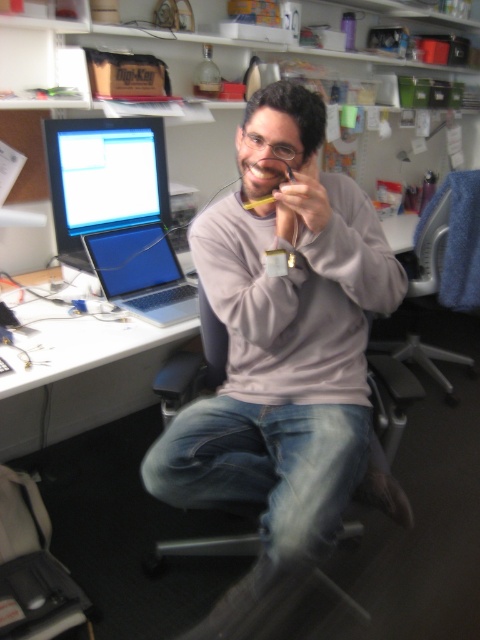
You are a delivery person who needs to place a small package on the desk. The package is too big to fit between the gray matte sweatshirt at center and the silver metallic laptop at left. Where should you place it instead?

Since the gray matte sweatshirt at center is closer to the viewer than the silver metallic laptop at left, the space between them is limited. To place the package, you should consider putting it either to the far right of the desk or behind the silver metallic laptop at left where there might be more space available.

You are a delivery robot trying to navigate to the desk. There are two points in your path. The first point is at point (179, 340) and the second point is at point (106, 129). Which point should you reach first to follow the correct path?

You should reach point (106, 129) first because it is in front of point (179, 340), so following the path you should go to point (106, 129) first before proceeding to point (179, 340).

You are a person who wants to sit down at the desk. Which object, the matte black monitor at upper left or the gray fabric swivel chair at right, is located to the left side of the other?

The matte black monitor at upper left is located to the left of the gray fabric swivel chair at right.